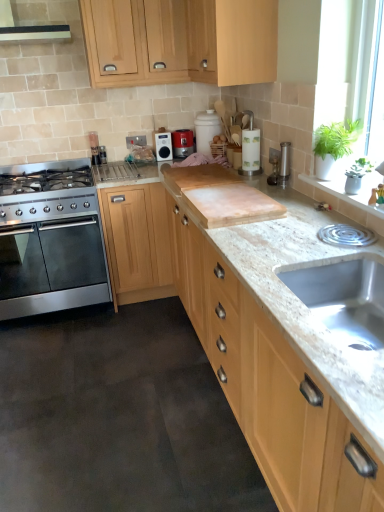
Question: Does matte black radio at center, arranged as the first kitchen appliance when viewed from the left, have a greater width compared to light wood cabinet at upper center, which is the second cabinetry from bottom to top?

Choices:
 (A) no
 (B) yes

Answer: (A)

Question: From a real-world perspective, is matte black radio at center, arranged as the first kitchen appliance when viewed from the left, beneath light wood cabinet at upper center, which is the second cabinetry from bottom to top?

Choices:
 (A) no
 (B) yes

Answer: (B)

Question: Considering the relative sizes of matte black radio at center, arranged as the first kitchen appliance when viewed from the left, and light wood cabinet at upper center, which is the second cabinetry from bottom to top, in the image provided, is matte black radio at center, arranged as the first kitchen appliance when viewed from the left, taller than light wood cabinet at upper center, which is the second cabinetry from bottom to top,?

Choices:
 (A) yes
 (B) no

Answer: (B)

Question: Considering the relative positions of matte black radio at center, arranged as the first kitchen appliance when viewed from the left, and light wood cabinet at upper center, which is the second cabinetry in top-to-bottom order, in the image provided, is matte black radio at center, arranged as the first kitchen appliance when viewed from the left, to the left of light wood cabinet at upper center, which is the second cabinetry in top-to-bottom order, from the viewer's perspective?

Choices:
 (A) yes
 (B) no

Answer: (A)

Question: From the image's perspective, is matte black radio at center, arranged as the first kitchen appliance when viewed from the left, over light wood cabinet at upper center, which is the second cabinetry from bottom to top?

Choices:
 (A) no
 (B) yes

Answer: (A)

Question: Relative to light wood cabinet at center, placed as the third cabinetry when sorted from top to bottom, is metallic silver toaster at upper center in front or behind?

Choices:
 (A) front
 (B) behind

Answer: (B)

Question: In terms of height, does metallic silver toaster at upper center look taller or shorter compared to light wood cabinet at center, the 1th cabinetry when ordered from bottom to top?

Choices:
 (A) tall
 (B) short

Answer: (B)

Question: Considering the relative positions of metallic silver toaster at upper center and light wood cabinet at center, placed as the third cabinetry when sorted from top to bottom, in the image provided, is metallic silver toaster at upper center to the left or to the right of light wood cabinet at center, placed as the third cabinetry when sorted from top to bottom,?

Choices:
 (A) right
 (B) left

Answer: (B)

Question: From a real-world perspective, is metallic silver toaster at upper center physically located above or below light wood cabinet at center, the 1th cabinetry when ordered from bottom to top?

Choices:
 (A) above
 (B) below

Answer: (A)

Question: Relative to light wood cabinet at upper center, the third cabinetry ordered from the bottom, is stainless steel gas stove at left in front or behind?

Choices:
 (A) behind
 (B) front

Answer: (A)

Question: Which is correct: stainless steel gas stove at left is inside light wood cabinet at upper center, the third cabinetry ordered from the bottom, or outside of it?

Choices:
 (A) inside
 (B) outside

Answer: (B)

Question: In the image, is stainless steel gas stove at left on the left side or the right side of light wood cabinet at upper center, the third cabinetry ordered from the bottom?

Choices:
 (A) left
 (B) right

Answer: (A)

Question: From the image's perspective, is stainless steel gas stove at left above or below light wood cabinet at upper center, which is the first cabinetry from top to bottom?

Choices:
 (A) above
 (B) below

Answer: (B)

Question: From a real-world perspective, relative to stainless steel gas stove at left, is light wood cabinet at upper center, which is the first cabinetry from top to bottom, vertically above or below?

Choices:
 (A) below
 (B) above

Answer: (B)

Question: Considering the positions of point (256, 5) and point (74, 203), is point (256, 5) closer or farther from the camera than point (74, 203)?

Choices:
 (A) farther
 (B) closer

Answer: (B)